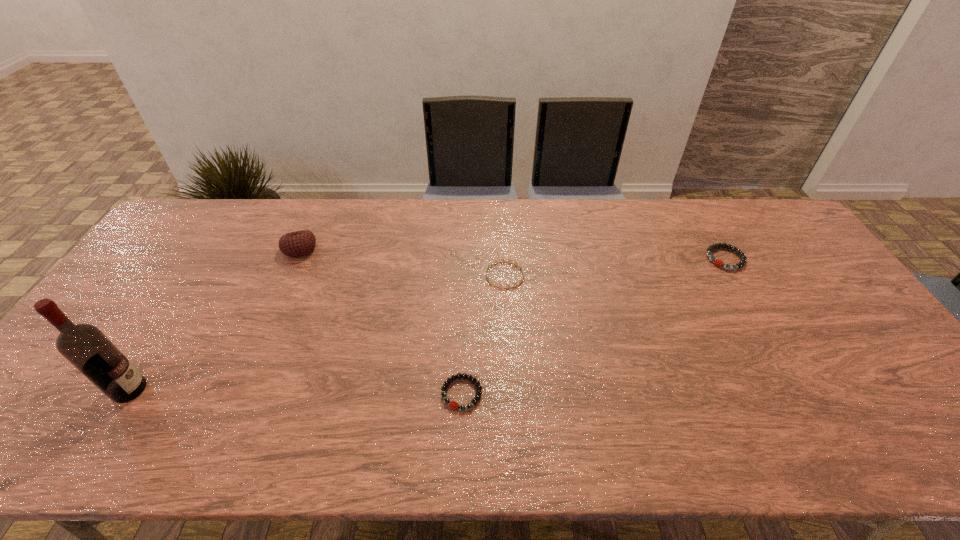
What are the coordinates of `vacant area that lies between the leftmost bracelet and the beanbag` in the screenshot? It's located at (381, 321).

At what (x,y) coordinates should I click in order to perform the action: click on empty space that is in between the leftmost bracelet and the rightmost object. Please return your answer as a coordinate pair (x, y). The width and height of the screenshot is (960, 540). Looking at the image, I should click on (593, 326).

Identify the location of vacant space that's between the second tallest object and the second object from right to left. (402, 262).

This screenshot has width=960, height=540. What are the coordinates of `object that is the third closest to the second bracelet from left to right` in the screenshot? It's located at (743, 259).

Choose which object is the fourth nearest neighbor to the fourth object from right to left. Please provide its 2D coordinates. Your answer should be formatted as a tuple, i.e. [(x, y)], where the tuple contains the x and y coordinates of a point satisfying the conditions above.

[(743, 259)]

Select which bracelet appears as the closest to the third tallest object. Please provide its 2D coordinates. Your answer should be formatted as a tuple, i.e. [(x, y)], where the tuple contains the x and y coordinates of a point satisfying the conditions above.

[(496, 261)]

What are the coordinates of `bracelet that is the third nearest to the second object from left to right` in the screenshot? It's located at (743, 259).

Image resolution: width=960 pixels, height=540 pixels. I want to click on free space that satisfies the following two spatial constraints: 1. on the front side of the third tallest object; 2. on the front and back of the leftmost object, so click(802, 390).

You are a GUI agent. You are given a task and a screenshot of the screen. Output one action in this format:
    pyautogui.click(x=<x>, y=<y>)
    Task: Click on the vacant space that satisfies the following two spatial constraints: 1. on the back side of the third object from left to right; 2. on the front and back of the leftmost object
    
    Given the screenshot: What is the action you would take?
    pyautogui.click(x=462, y=390)

Locate an element on the screen. free space that satisfies the following two spatial constraints: 1. on the front side of the beanbag; 2. on the left side of the third object from left to right is located at coordinates (237, 394).